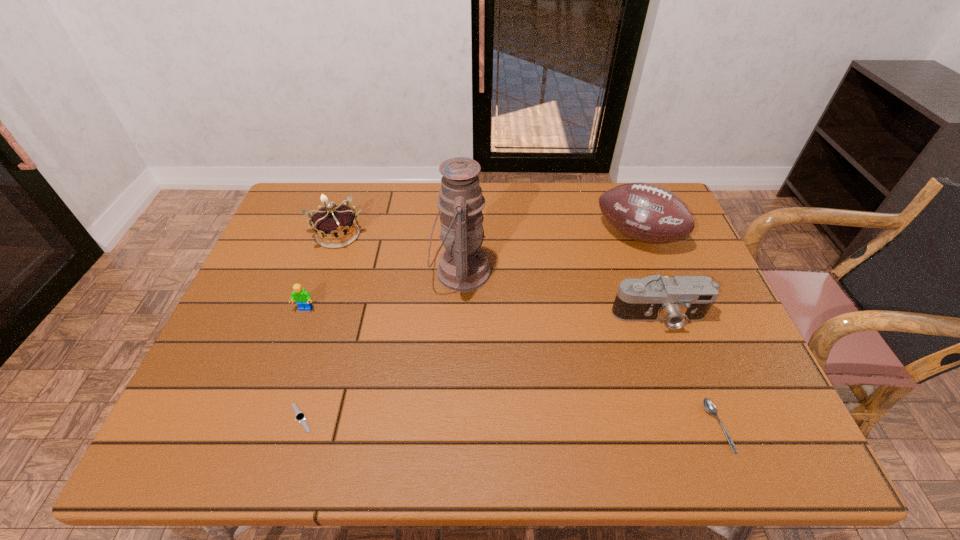
I want to click on object that stands as the closest to the football (American), so click(675, 301).

I want to click on vacant point that satisfies the following two spatial constraints: 1. on the lens of the soupspoon; 2. on the right side of the camera, so click(x=699, y=426).

Where is `free space that satisfies the following two spatial constraints: 1. on the front side of the soupspoon; 2. on the right side of the football (American)`? free space that satisfies the following two spatial constraints: 1. on the front side of the soupspoon; 2. on the right side of the football (American) is located at coordinates (709, 426).

This screenshot has width=960, height=540. What are the coordinates of `vacant region that satisfies the following two spatial constraints: 1. on the back side of the football (American); 2. on the left side of the oil lamp` in the screenshot? It's located at (462, 236).

Locate an element on the screen. The image size is (960, 540). free region that satisfies the following two spatial constraints: 1. on the front side of the soupspoon; 2. on the left side of the second tallest object is located at coordinates (709, 426).